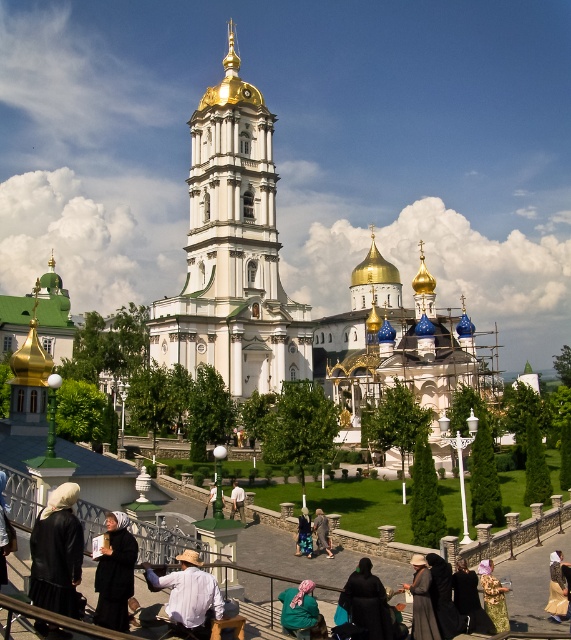
Looking at this image, between light brown fabric dress at center and light brown leather jacket at center, which one appears on the right side from the viewer's perspective?

Positioned to the right is light brown fabric dress at center.

Is light brown fabric dress at center taller than light brown leather jacket at center?

Incorrect, light brown fabric dress at center's height is not larger of light brown leather jacket at center's.

Between point (323, 525) and point (210, 493), which one is positioned in front?

Point (323, 525) is in front.

At what (x,y) coordinates should I click in order to perform the action: click on light brown fabric dress at center. Please return your answer as a coordinate pair (x, y). This screenshot has height=640, width=571. Looking at the image, I should click on (321, 532).

Is dark fabric headscarf at lower right thinner than blue denim jacket at center?

No, dark fabric headscarf at lower right is not thinner than blue denim jacket at center.

Does dark fabric headscarf at lower right appear under blue denim jacket at center?

Actually, dark fabric headscarf at lower right is above blue denim jacket at center.

Measure the distance between dark fabric headscarf at lower right and camera.

dark fabric headscarf at lower right and camera are 51.51 meters apart from each other.

This screenshot has height=640, width=571. What are the coordinates of `dark fabric headscarf at lower right` in the screenshot? It's located at (443, 596).

Which is more to the left, white cotton shirt at lower center or black fabric headscarf at lower center?

Positioned to the left is white cotton shirt at lower center.

Is white cotton shirt at lower center shorter than black fabric headscarf at lower center?

No, white cotton shirt at lower center is not shorter than black fabric headscarf at lower center.

Which is behind, point (179, 621) or point (355, 580)?

Positioned behind is point (355, 580).

Where is `white cotton shirt at lower center`? white cotton shirt at lower center is located at coordinates (186, 595).